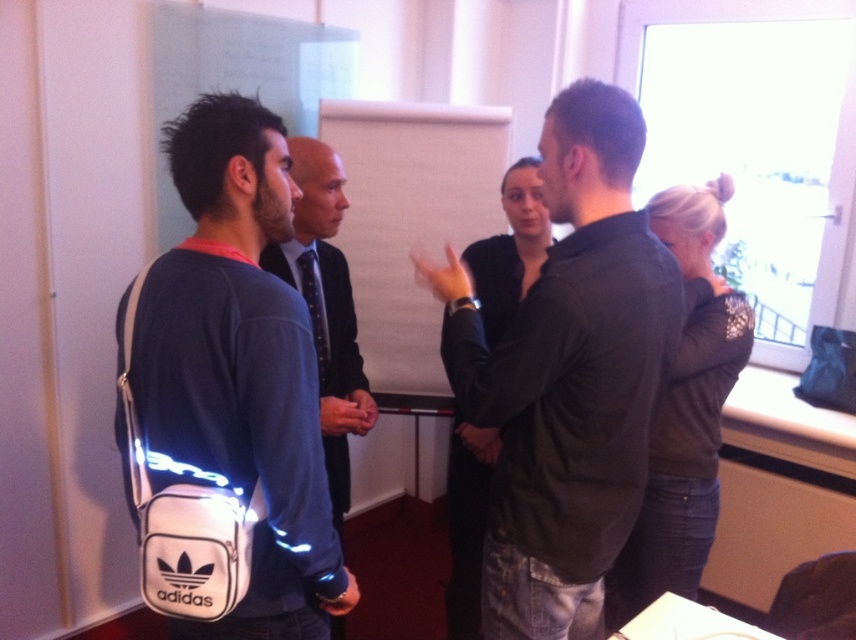
Is dark green shirt at center positioned behind white synthetic adidas bag at left?

That is True.

Is dark green shirt at center taller than white synthetic adidas bag at left?

Yes.

Locate an element on the screen. The height and width of the screenshot is (640, 856). dark green shirt at center is located at coordinates (568, 376).

Find the location of a particular element. The width and height of the screenshot is (856, 640). dark green shirt at center is located at coordinates (568, 376).

Looking at this image, can you confirm if dark green shirt at center is taller than blue denim shirt at center?

Indeed, dark green shirt at center has a greater height compared to blue denim shirt at center.

Can you confirm if dark green shirt at center is positioned below blue denim shirt at center?

Indeed, dark green shirt at center is positioned under blue denim shirt at center.

Between point (610, 145) and point (354, 316), which one is positioned in front?

Point (610, 145) is more forward.

The height and width of the screenshot is (640, 856). In order to click on dark green shirt at center in this screenshot , I will do `click(568, 376)`.

Between white synthetic adidas bag at left and blue denim shirt at center, which one is positioned lower?

Positioned lower is white synthetic adidas bag at left.

Looking at this image, is white synthetic adidas bag at left smaller than blue denim shirt at center?

Actually, white synthetic adidas bag at left might be larger than blue denim shirt at center.

This screenshot has height=640, width=856. Describe the element at coordinates (239, 369) in the screenshot. I see `white synthetic adidas bag at left` at that location.

At what (x,y) coordinates should I click in order to perform the action: click on white synthetic adidas bag at left. Please return your answer as a coordinate pair (x, y). This screenshot has height=640, width=856. Looking at the image, I should click on (239, 369).